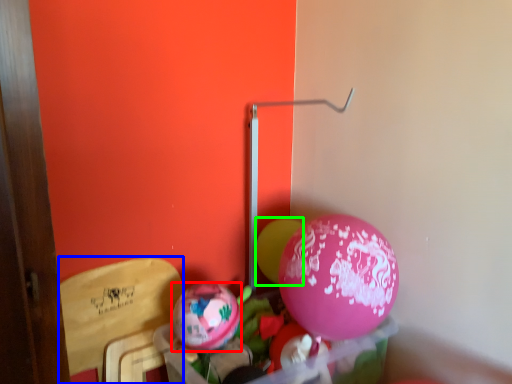
Question: Estimate the real-world distances between objects in this image. Which object is closer to balloon (highlighted by a red box), armchair (highlighted by a blue box) or balloon (highlighted by a green box)?

Choices:
 (A) armchair
 (B) balloon

Answer: (A)